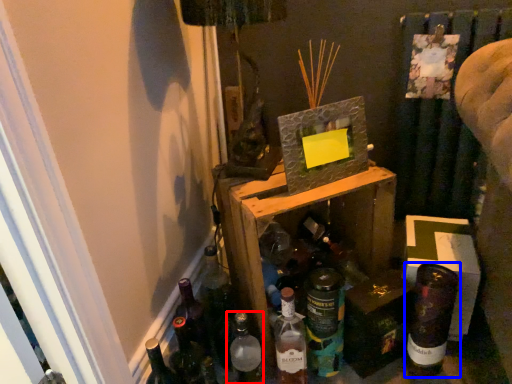
Question: Which of the following is the farthest to the observer, bottle (highlighted by a red box) or bottle (highlighted by a blue box)?

Choices:
 (A) bottle
 (B) bottle

Answer: (B)